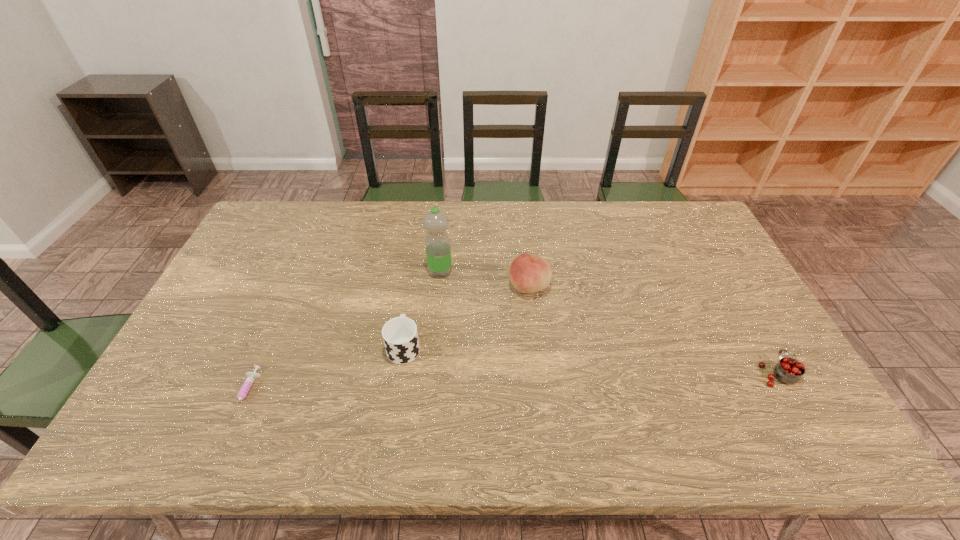
Locate an element on the screen. Image resolution: width=960 pixels, height=540 pixels. vacant space that is in between the rightmost object and the cup is located at coordinates (590, 360).

Where is `object that is the second closest to the fourth object from left to right`? Image resolution: width=960 pixels, height=540 pixels. object that is the second closest to the fourth object from left to right is located at coordinates (400, 336).

Find the location of a particular element. the second closest object to the tallest object is located at coordinates (400, 336).

Identify the location of free space that satisfies the following two spatial constraints: 1. on the side of the fourth shortest object with the handle; 2. on the left side of the cup. (413, 287).

At what (x,y) coordinates should I click in order to perform the action: click on vacant space that satisfies the following two spatial constraints: 1. on the side of the cup with the handle; 2. on the left side of the fourth object from left to right. Please return your answer as a coordinate pair (x, y). Looking at the image, I should click on (413, 287).

Find the location of `free space that satisfies the following two spatial constraints: 1. on the back side of the water bottle; 2. on the right side of the shortest object`. free space that satisfies the following two spatial constraints: 1. on the back side of the water bottle; 2. on the right side of the shortest object is located at coordinates (300, 272).